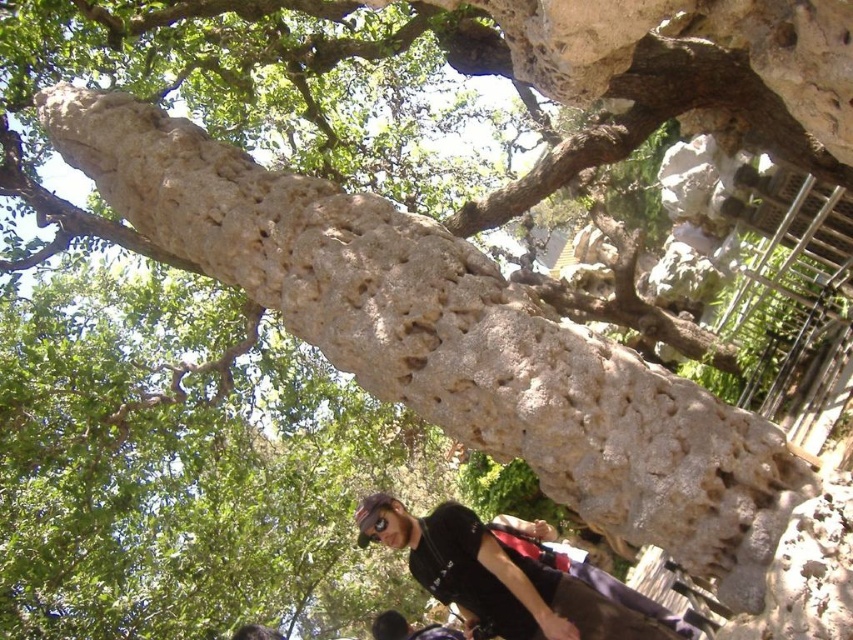
Who is positioned more to the left, black matte skateboarder at center or matte black goggles at center?

Positioned to the left is matte black goggles at center.

Find the location of a particular element. The image size is (853, 640). black matte skateboarder at center is located at coordinates (509, 580).